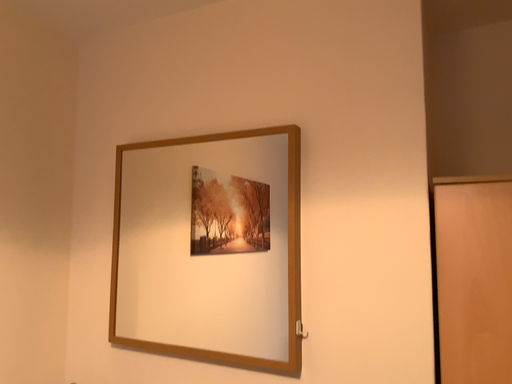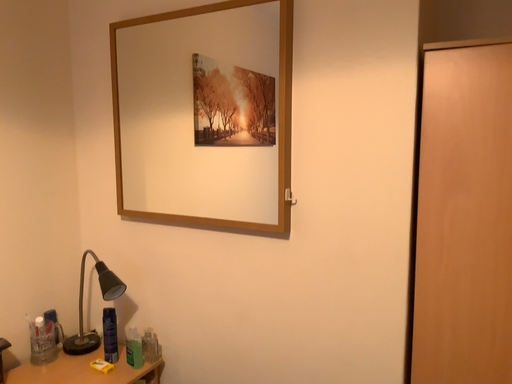
Question: Which way did the camera rotate in the video?

Choices:
 (A) rotated upward
 (B) rotated downward

Answer: (B)